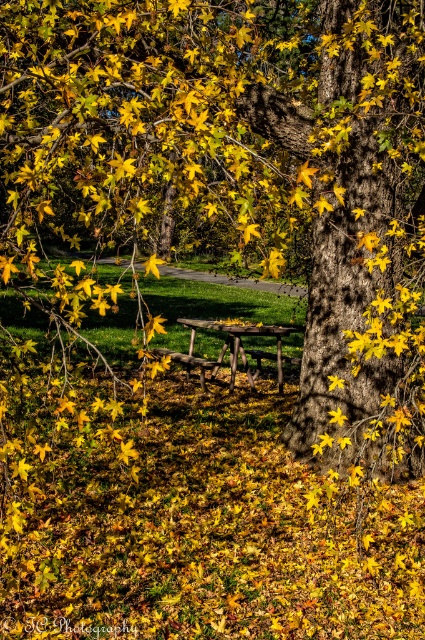
Can you confirm if yellow-green leaves at center is smaller than wooden park bench at center?

Incorrect, yellow-green leaves at center is not smaller in size than wooden park bench at center.

Is point (195, 1) closer to camera compared to point (187, 358)?

Yes, point (195, 1) is in front of point (187, 358).

Is point (76, 150) in front of point (266, 326)?

Yes, it is.

Where is `yellow-green leaves at center`? The width and height of the screenshot is (425, 640). yellow-green leaves at center is located at coordinates (240, 172).